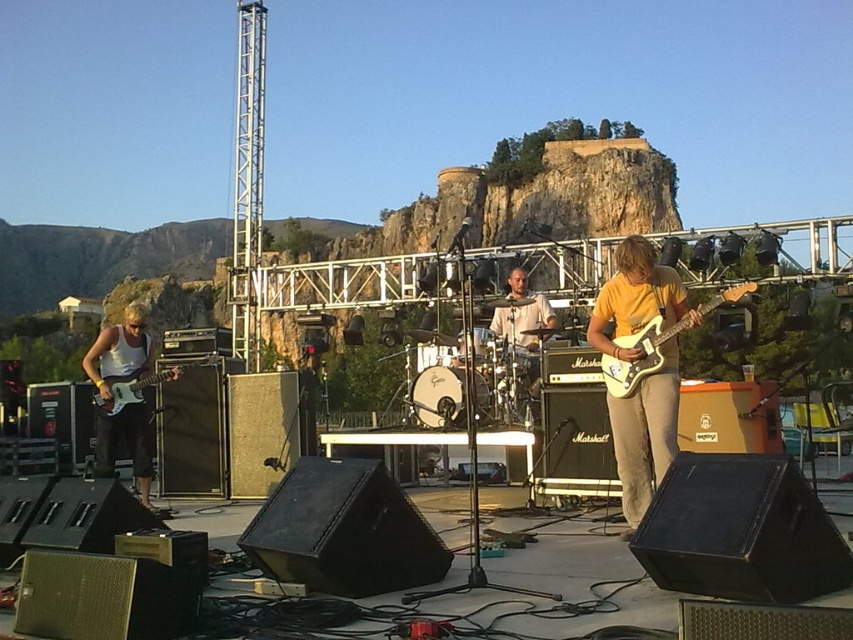
Question: Among these points, which one is nearest to the camera?

Choices:
 (A) (624, 365)
 (B) (135, 342)
 (C) (531, 298)

Answer: (A)

Question: In this image, where is white matte guitar at left located relative to light beige drum set at center?

Choices:
 (A) above
 (B) below

Answer: (B)

Question: Can you confirm if white matte guitar at left is thinner than white glossy electric guitar at right?

Choices:
 (A) yes
 (B) no

Answer: (B)

Question: Can you confirm if white matte guitar at left is thinner than matte white electric guitar at left?

Choices:
 (A) no
 (B) yes

Answer: (A)

Question: Which object is positioned closest to the white glossy electric guitar at right?

Choices:
 (A) white matte guitar at left
 (B) light beige drum set at center
 (C) yellow matte guitar at center
 (D) matte white electric guitar at left

Answer: (C)

Question: Which point is farther from the camera taking this photo?

Choices:
 (A) tap(526, 356)
 (B) tap(625, 436)

Answer: (A)